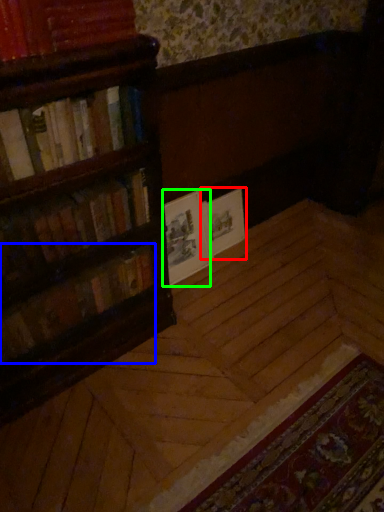
Question: Considering the real-world distances, which object is closest to book cover (highlighted by a red box)? book (highlighted by a blue box) or paperback book (highlighted by a green box).

Choices:
 (A) book
 (B) paperback book

Answer: (B)